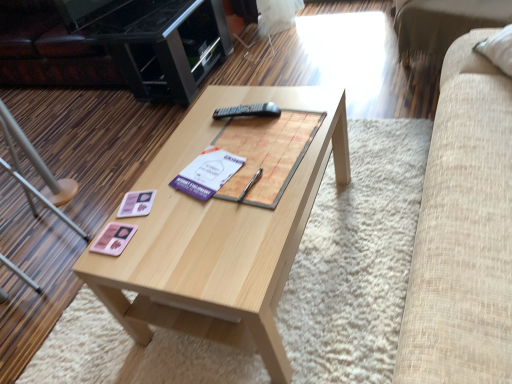
Question: Is light wood coffee table at center wider or thinner than beige fabric couch at upper right?

Choices:
 (A) thin
 (B) wide

Answer: (B)

Question: From the image's perspective, relative to beige fabric couch at upper right, is light wood coffee table at center above or below?

Choices:
 (A) above
 (B) below

Answer: (B)

Question: Which is farther from the white paper at center?

Choices:
 (A) light wood coffee table at center
 (B) pink matte coaster at center-left
 (C) wooden magazine at center
 (D) pink matte card game at center
 (E) black glossy entertainment center at upper left

Answer: (E)

Question: Which is farther from the black glossy entertainment center at upper left?

Choices:
 (A) white paper at center
 (B) black plastic remote at center
 (C) beige fabric couch at upper right
 (D) metallic silver chair at lower left
 (E) pink matte card game at center

Answer: (E)